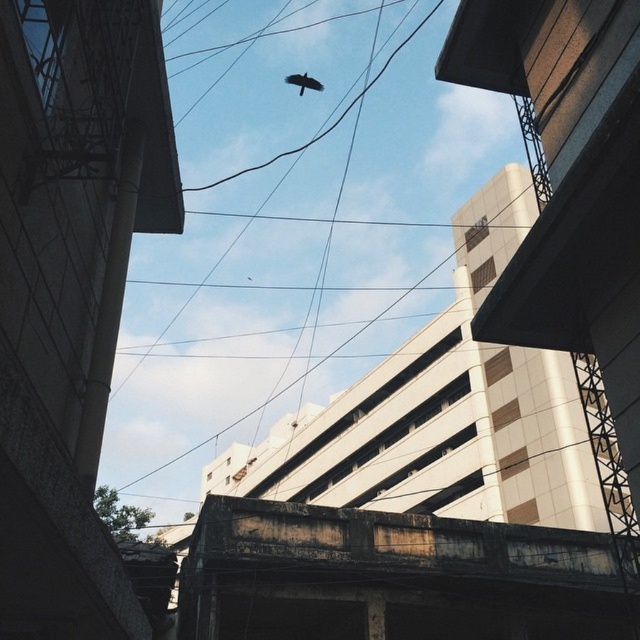
You are a delivery person carrying a package that requires a clear path under the rusty concrete overpass at center. The package can only pass through spaces taller than 2.5 meters. Based on the scene, can you determine if the overpass is tall enough for your package?

The rusty concrete overpass at center is 8.58 meters from camera. Since the height of the overpass isn not specified, but the distance from the camera is given, it is unclear if the height is sufficient for the package. Additional information about the actual height of the overpass would be needed to determine if it is tall enough.

Consider the image. You are a birdwatcher standing in the middle of the street. You notice a dark brown feathered bird at center and a rusty concrete overpass at center. Which object is closer to your left side?

The dark brown feathered bird at center is closer to your left side because the rusty concrete overpass at center is positioned on the right side of it.

You are standing on the sidewalk looking up at the scene. Which object is closer to the ground between the rusty concrete overpass at center and the dark brown feathered bird at center?

The rusty concrete overpass at center is closer to the ground because it is located below the dark brown feathered bird at center.